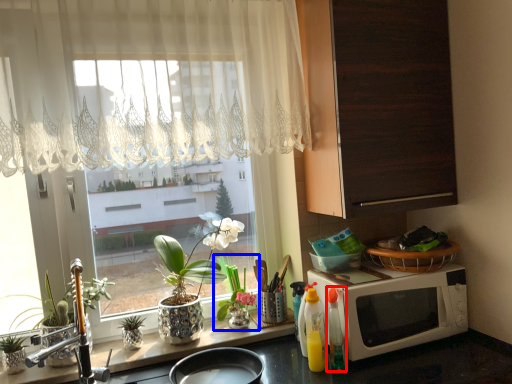
Question: Which object is further to the camera taking this photo, bottle (highlighted by a red box) or houseplant (highlighted by a blue box)?

Choices:
 (A) bottle
 (B) houseplant

Answer: (B)